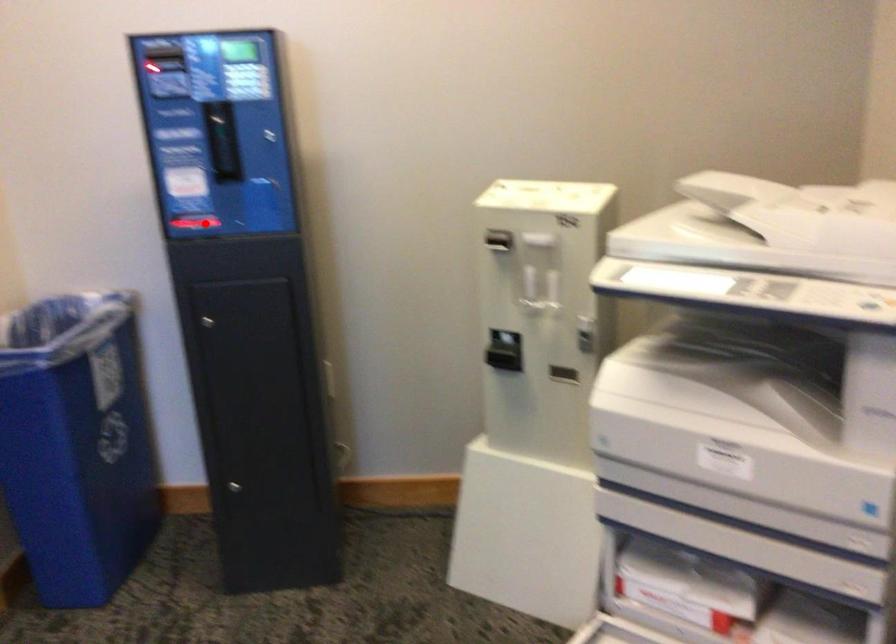
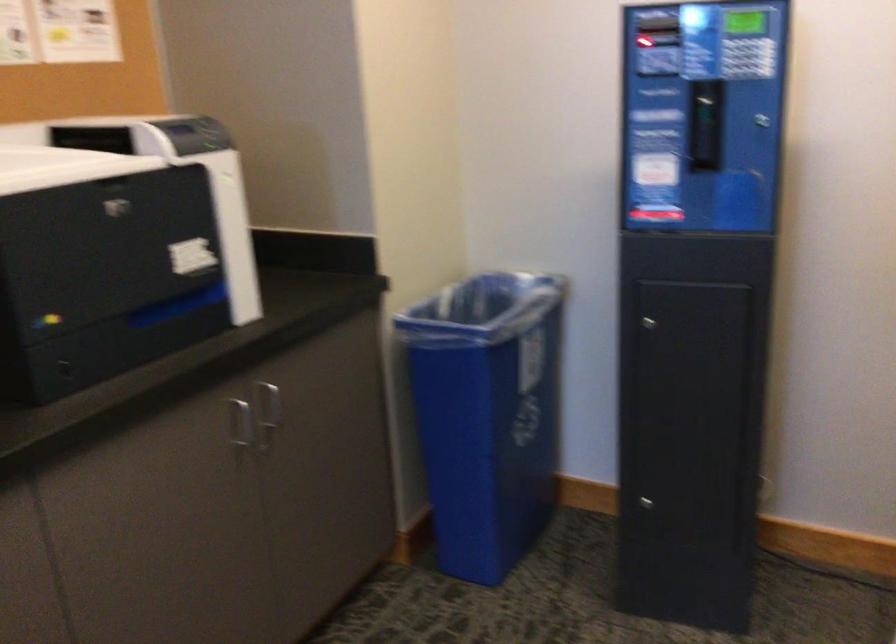
Locate, in the second image, the point that corresponds to the highlighted location in the first image.

(655, 212)